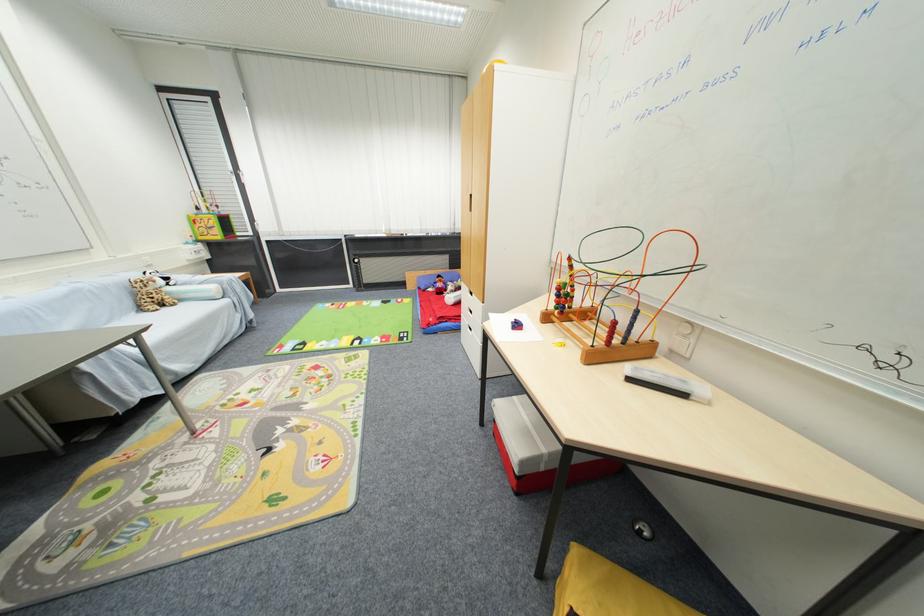
Where would you pull the bottom white drawer handle? Please return your answer as a coordinate pair (x, y).

(468, 329)